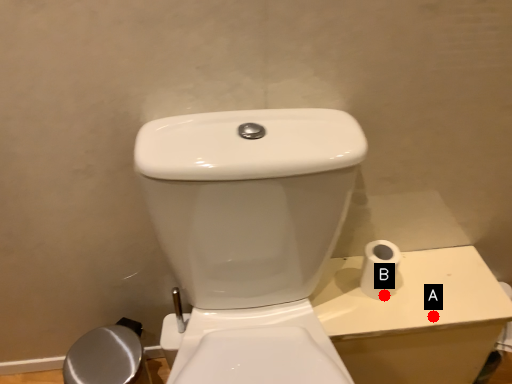
Question: Two points are circled on the image, labeled by A and B beside each circle. Among these points, which one is farthest from the camera?

Choices:
 (A) A is further
 (B) B is further

Answer: (B)